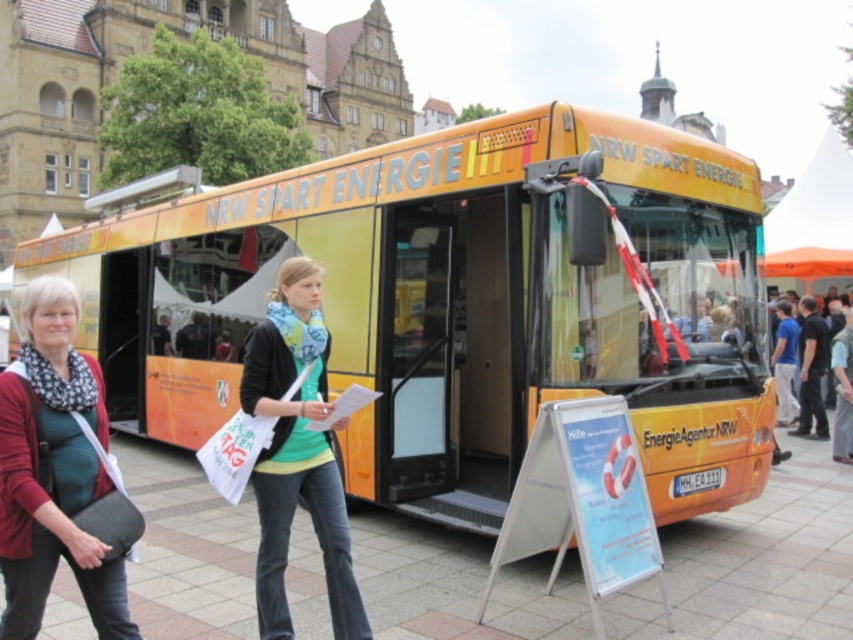
You are a photographer trying to capture a photo of the NRW SPART ENERGIE bus. You notice the matte black jacket at center and the light beige fabric pants at lower right in your frame. Which object should you focus on if you want to highlight something taller in the scene?

Result: The matte black jacket at center should be focused on since it has a greater height compared to the light beige fabric pants at lower right.

You are standing at the front of the NRW SPART ENERGIE bus and want to hand a flyer to the person wearing the matte black jacket at center. Based on their position relative to the bus, can you walk directly towards them without needing to go around the bus?

The matte black jacket at center is located at point (x=296, y=452), which means they are positioned in the central area relative to the bus. Since they are in the foreground and walking past the bus, you can likely walk directly towards them without needing to go around the bus as there is a clear path from the front of the bus to their location.

You are a photographer trying to capture both the matte black jacket at lower left and the matte black jacket at center in a single frame. Which jacket should you focus on to ensure both are in the shot without needing to adjust your camera angle?

You should focus on the matte black jacket at lower left because it is larger in size than the matte black jacket at center, making it easier to include both in the frame without adjusting the camera angle.